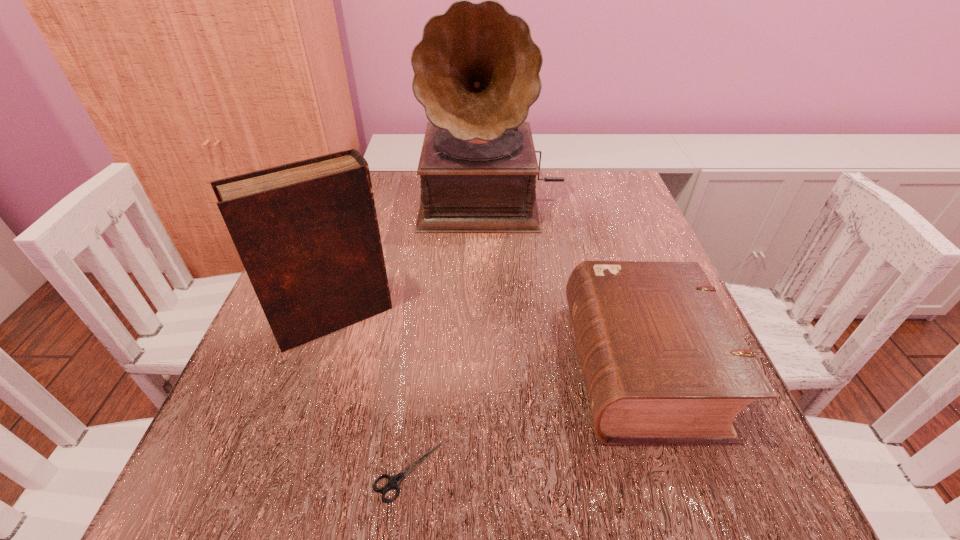
The width and height of the screenshot is (960, 540). Identify the location of vacant area that lies between the shortest object and the record player. (449, 335).

Identify the location of vacant space that's between the left Bible and the farthest object. (413, 258).

Locate an element on the screen. Image resolution: width=960 pixels, height=540 pixels. the third closest object to the third tallest object is located at coordinates coord(307,233).

The height and width of the screenshot is (540, 960). Identify the location of object that stands as the closest to the farthest object. (307, 233).

The height and width of the screenshot is (540, 960). Identify the location of free space that satisfies the following two spatial constraints: 1. on the spine side of the right Bible; 2. on the front side of the shears. pyautogui.click(x=676, y=471).

Locate an element on the screen. The image size is (960, 540). vacant space that satisfies the following two spatial constraints: 1. on the front side of the left Bible; 2. on the right side of the shears is located at coordinates (284, 471).